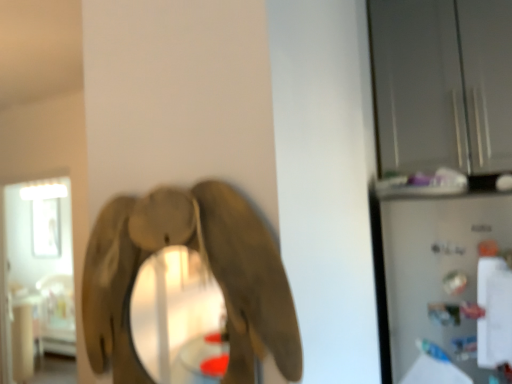
What is the approximate width of transparent glass door at left, the 1th glass door from the back?

16.06 centimeters.

This screenshot has width=512, height=384. Identify the location of transparent glass cabinet at upper right, the first glass door when ordered from top to bottom. (442, 84).

Find the location of a particular element. satin silver refrigerator at right is located at coordinates (431, 272).

I want to click on transparent glass door at left, the 1th glass door from the back, so click(x=37, y=267).

From a real-world perspective, is wooden elephant at center above or below transparent glass cabinet at upper right, acting as the second glass door starting from the back?

wooden elephant at center is situated lower than transparent glass cabinet at upper right, acting as the second glass door starting from the back, in the real world.

Would you consider wooden elephant at center to be distant from transparent glass cabinet at upper right, acting as the second glass door starting from the back?

→ wooden elephant at center is positioned a significant distance from transparent glass cabinet at upper right, acting as the second glass door starting from the back.

Could you tell me if wooden elephant at center is facing transparent glass cabinet at upper right, the first glass door when ordered from top to bottom?

No, wooden elephant at center is not facing towards transparent glass cabinet at upper right, the first glass door when ordered from top to bottom.

From the image's perspective, does wooden elephant at center appear lower than transparent glass cabinet at upper right, the second glass door in the left-to-right sequence?

Yes.

Is transparent glass cabinet at upper right, the first glass door when ordered from top to bottom, taller or shorter than transparent glass door at left, the 1th glass door from the back?

Clearly, transparent glass cabinet at upper right, the first glass door when ordered from top to bottom, is shorter compared to transparent glass door at left, the 1th glass door from the back.

Where is `glass door that appears behind the transparent glass cabinet at upper right, marked as the 2th glass door in a bottom-to-top arrangement`? glass door that appears behind the transparent glass cabinet at upper right, marked as the 2th glass door in a bottom-to-top arrangement is located at coordinates (37, 267).

Is transparent glass cabinet at upper right, marked as the 2th glass door in a bottom-to-top arrangement, at the right side of transparent glass door at left, which is counted as the 1th glass door, starting from the left?

Correct, you'll find transparent glass cabinet at upper right, marked as the 2th glass door in a bottom-to-top arrangement, to the right of transparent glass door at left, which is counted as the 1th glass door, starting from the left.

Which of these two, transparent glass cabinet at upper right, which is the first glass door from front to back, or transparent glass door at left, marked as the second glass door in a top-to-bottom arrangement, is smaller?

Smaller between the two is transparent glass cabinet at upper right, which is the first glass door from front to back.

Is satin silver refrigerator at right smaller than transparent glass door at left, marked as the second glass door in a top-to-bottom arrangement?

Yes.

Considering the relative sizes of satin silver refrigerator at right and transparent glass door at left, the 1th glass door from the back, in the image provided, is satin silver refrigerator at right thinner than transparent glass door at left, the 1th glass door from the back,?

Yes.

From the image's perspective, is satin silver refrigerator at right under transparent glass door at left, the 1th glass door from the back?

Actually, satin silver refrigerator at right appears above transparent glass door at left, the 1th glass door from the back, in the image.

Based on their positions, is satin silver refrigerator at right located to the left or right of transparent glass door at left, arranged as the 2th glass door when viewed from the right?

In the image, satin silver refrigerator at right appears on the right side of transparent glass door at left, arranged as the 2th glass door when viewed from the right.

Looking at the image, does transparent glass cabinet at upper right, which is the 1th glass door from right to left, seem bigger or smaller compared to satin silver refrigerator at right?

Considering their sizes, transparent glass cabinet at upper right, which is the 1th glass door from right to left, takes up more space than satin silver refrigerator at right.

Which point is more distant from viewer, (x=444, y=160) or (x=417, y=236)?

The point (x=444, y=160) is more distant.

Does transparent glass cabinet at upper right, marked as the 2th glass door in a bottom-to-top arrangement, appear on the left side of satin silver refrigerator at right?

In fact, transparent glass cabinet at upper right, marked as the 2th glass door in a bottom-to-top arrangement, is to the right of satin silver refrigerator at right.

Is transparent glass cabinet at upper right, acting as the second glass door starting from the back, positioned far away from satin silver refrigerator at right?

transparent glass cabinet at upper right, acting as the second glass door starting from the back, is actually quite close to satin silver refrigerator at right.

From the image's perspective, is transparent glass door at left, arranged as the 2th glass door when viewed from the right, on wooden elephant at center?

No, from the image's perspective, transparent glass door at left, arranged as the 2th glass door when viewed from the right, is not above wooden elephant at center.

Does transparent glass door at left, marked as the second glass door in a top-to-bottom arrangement, have a lesser width compared to wooden elephant at center?

No, transparent glass door at left, marked as the second glass door in a top-to-bottom arrangement, is not thinner than wooden elephant at center.

Is wooden elephant at center surrounded by transparent glass door at left, arranged as the 2th glass door when viewed from the right?

That's incorrect, wooden elephant at center is not inside transparent glass door at left, arranged as the 2th glass door when viewed from the right.

Between transparent glass cabinet at upper right, the second glass door in the left-to-right sequence, and wooden elephant at center, which one is positioned behind?

transparent glass cabinet at upper right, the second glass door in the left-to-right sequence.

Is transparent glass cabinet at upper right, the first glass door when ordered from top to bottom, with wooden elephant at center?

transparent glass cabinet at upper right, the first glass door when ordered from top to bottom, is not next to wooden elephant at center, and they're not touching.

You are a GUI agent. You are given a task and a screenshot of the screen. Output one action in this format:
    pyautogui.click(x=<x>, y=<y>)
    Task: Click on the elephant on the left of transparent glass cabinet at upper right, the first glass door when ordered from top to bottom
    This screenshot has width=512, height=384.
    Given the screenshot: What is the action you would take?
    pyautogui.click(x=208, y=265)

Is transparent glass cabinet at upper right, acting as the second glass door starting from the back, at the right side of wooden elephant at center?

Correct, you'll find transparent glass cabinet at upper right, acting as the second glass door starting from the back, to the right of wooden elephant at center.

Would you consider transparent glass door at left, the first glass door positioned from the bottom, to be distant from transparent glass cabinet at upper right, the second glass door in the left-to-right sequence?

That's right, there is a large distance between transparent glass door at left, the first glass door positioned from the bottom, and transparent glass cabinet at upper right, the second glass door in the left-to-right sequence.

In the scene shown: Between transparent glass door at left, arranged as the 2th glass door when viewed from the right, and transparent glass cabinet at upper right, which is the first glass door from front to back, which one is positioned in front?

transparent glass cabinet at upper right, which is the first glass door from front to back, is in front.

Is transparent glass door at left, marked as the second glass door in a top-to-bottom arrangement, positioned beyond the bounds of transparent glass cabinet at upper right, the first glass door when ordered from top to bottom?

Indeed, transparent glass door at left, marked as the second glass door in a top-to-bottom arrangement, is completely outside transparent glass cabinet at upper right, the first glass door when ordered from top to bottom.

In terms of width, does transparent glass door at left, the 1th glass door from the back, look wider or thinner when compared to transparent glass cabinet at upper right, acting as the second glass door starting from the back?

Considering their sizes, transparent glass door at left, the 1th glass door from the back, looks slimmer than transparent glass cabinet at upper right, acting as the second glass door starting from the back.

Which glass door is the 1st one when counting from the back of the wooden elephant at center? Please provide its 2D coordinates.

[(442, 84)]

The image size is (512, 384). In order to click on glass door lying in front of the transparent glass door at left, arranged as the 2th glass door when viewed from the right in this screenshot , I will do `click(442, 84)`.

From the image, which object appears to be farther from satin silver refrigerator at right, transparent glass door at left, the 2th glass door positioned from the front, or transparent glass cabinet at upper right, the second glass door in the left-to-right sequence?

The object further to satin silver refrigerator at right is transparent glass door at left, the 2th glass door positioned from the front.

Estimate the real-world distances between objects in this image. Which object is closer to wooden elephant at center, transparent glass cabinet at upper right, marked as the 2th glass door in a bottom-to-top arrangement, or satin silver refrigerator at right?

Based on the image, satin silver refrigerator at right appears to be nearer to wooden elephant at center.

Looking at the image, which one is located closer to transparent glass door at left, the 1th glass door from the back, wooden elephant at center or satin silver refrigerator at right?

satin silver refrigerator at right lies closer to transparent glass door at left, the 1th glass door from the back, than the other object.

Looking at the image, which one is located closer to wooden elephant at center, satin silver refrigerator at right or transparent glass door at left, which is counted as the 1th glass door, starting from the left?

The object closer to wooden elephant at center is satin silver refrigerator at right.

Looking at the image, which one is located further to transparent glass cabinet at upper right, which is the 1th glass door from right to left, transparent glass door at left, the 2th glass door positioned from the front, or satin silver refrigerator at right?

transparent glass door at left, the 2th glass door positioned from the front, is further to transparent glass cabinet at upper right, which is the 1th glass door from right to left.

From the image, which object appears to be farther from transparent glass door at left, the 2th glass door positioned from the front, wooden elephant at center or transparent glass cabinet at upper right, the first glass door when ordered from top to bottom?

wooden elephant at center.

Looking at the image, which one is located closer to satin silver refrigerator at right, transparent glass door at left, marked as the second glass door in a top-to-bottom arrangement, or wooden elephant at center?

Based on the image, wooden elephant at center appears to be nearer to satin silver refrigerator at right.

Estimate the real-world distances between objects in this image. Which object is closer to transparent glass cabinet at upper right, the second glass door in the left-to-right sequence, wooden elephant at center or transparent glass door at left, arranged as the 2th glass door when viewed from the right?

Based on the image, wooden elephant at center appears to be nearer to transparent glass cabinet at upper right, the second glass door in the left-to-right sequence.

Where is `appliance between wooden elephant at center and transparent glass door at left, marked as the second glass door in a top-to-bottom arrangement, along the z-axis`? appliance between wooden elephant at center and transparent glass door at left, marked as the second glass door in a top-to-bottom arrangement, along the z-axis is located at coordinates (431, 272).

Where is `elephant between transparent glass door at left, arranged as the 2th glass door when viewed from the right, and transparent glass cabinet at upper right, the first glass door when ordered from top to bottom`? elephant between transparent glass door at left, arranged as the 2th glass door when viewed from the right, and transparent glass cabinet at upper right, the first glass door when ordered from top to bottom is located at coordinates (208, 265).

The width and height of the screenshot is (512, 384). Find the location of `appliance located between wooden elephant at center and transparent glass cabinet at upper right, marked as the 2th glass door in a bottom-to-top arrangement, in the left-right direction`. appliance located between wooden elephant at center and transparent glass cabinet at upper right, marked as the 2th glass door in a bottom-to-top arrangement, in the left-right direction is located at coordinates (431, 272).

I want to click on appliance situated between transparent glass door at left, marked as the second glass door in a top-to-bottom arrangement, and transparent glass cabinet at upper right, the first glass door when ordered from top to bottom, from left to right, so click(431, 272).